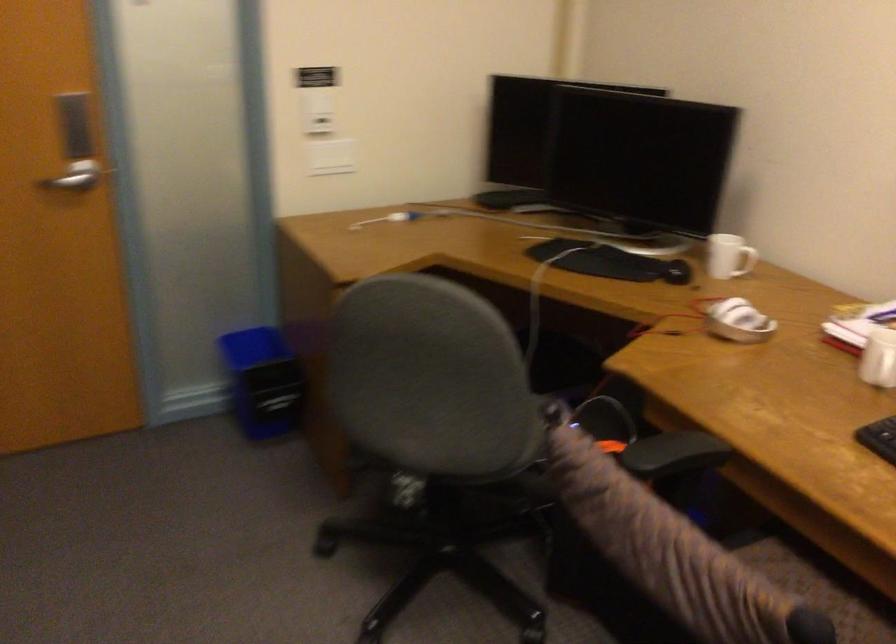
Find the location of a particular element. The image size is (896, 644). white headphones is located at coordinates (737, 321).